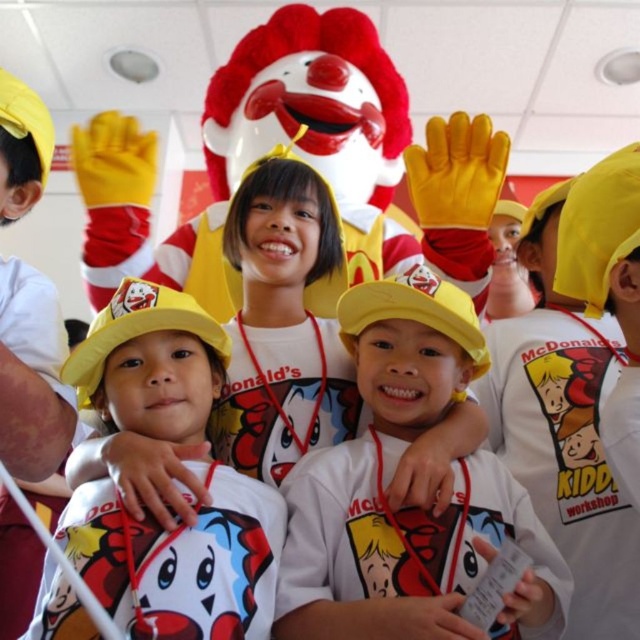
You are a photographer trying to capture the best angle of the Kiddie Workshop event. You notice two points marked in the scene. Which point, point (396,628) or point (83,348), is closer to your camera lens?

Point (396,628) is closer to the camera lens than point (83,348).

You are a photographer trying to capture the children in the McDonalds Kiddie Workshop. You notice the yellow matte cap at center and the yellow matte hat at center. Which one is positioned higher in the image?

The yellow matte cap at center is located above the yellow matte hat at center, so it is positioned higher in the image.